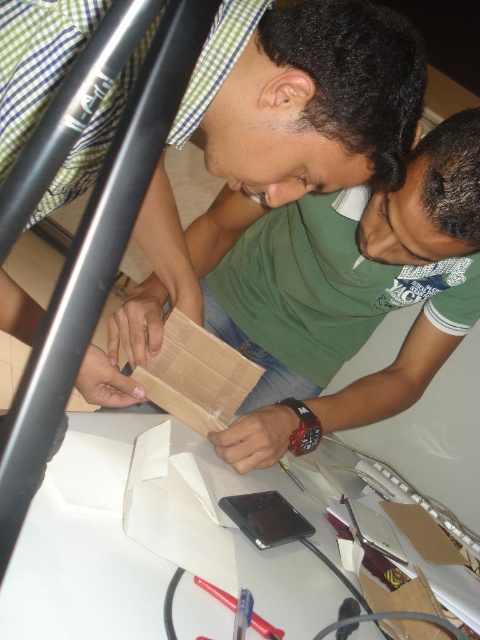
Question: In this image, where is brown cardboard at center located relative to metallic silver pen at lower center?

Choices:
 (A) below
 (B) above

Answer: (B)

Question: Based on their relative distances, which object is nearer to the metallic silver pen at lower center?

Choices:
 (A) green matte shirt at center
 (B) brown cardboard at center

Answer: (A)

Question: Which object is positioned closest to the metallic silver pen at lower center?

Choices:
 (A) green matte shirt at center
 (B) brown cardboard at center

Answer: (A)

Question: From the image, what is the correct spatial relationship of brown cardboard at center in relation to green matte shirt at center?

Choices:
 (A) below
 (B) above

Answer: (A)

Question: Considering the real-world distances, which object is farthest from the metallic silver pen at lower center?

Choices:
 (A) brown cardboard at center
 (B) green matte shirt at center

Answer: (A)

Question: Does green matte shirt at center have a larger size compared to metallic silver pen at lower center?

Choices:
 (A) no
 (B) yes

Answer: (B)